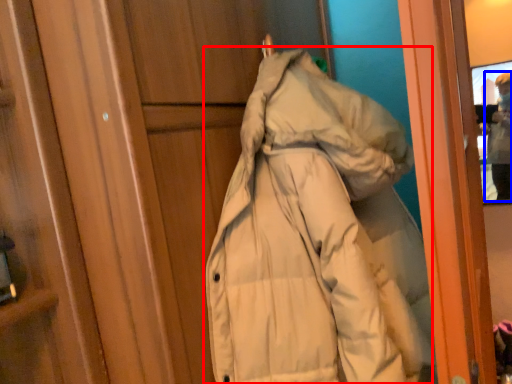
Question: Which point is further to the camera, coat (highlighted by a red box) or individual (highlighted by a blue box)?

Choices:
 (A) coat
 (B) individual

Answer: (B)